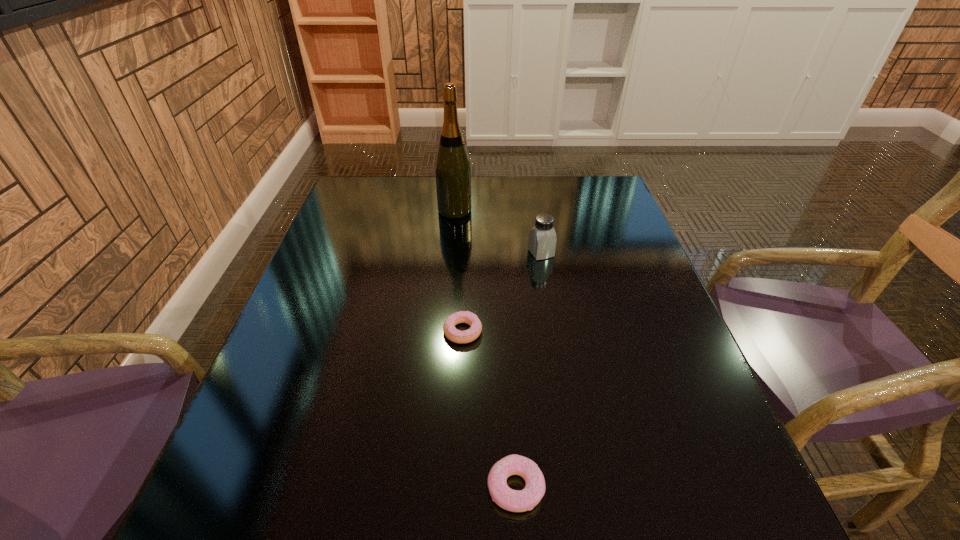
Locate an element on the screen. This screenshot has width=960, height=540. the farthest object is located at coordinates (452, 167).

Find the location of a particular element. the tallest object is located at coordinates (452, 167).

The height and width of the screenshot is (540, 960). I want to click on saltshaker, so click(x=542, y=237).

You are a GUI agent. You are given a task and a screenshot of the screen. Output one action in this format:
    pyautogui.click(x=<x>, y=<y>)
    Task: Click on the rightmost object
    
    Given the screenshot: What is the action you would take?
    pyautogui.click(x=542, y=237)

I want to click on the farther doughnut, so click(461, 337).

At what (x,y) coordinates should I click in order to perform the action: click on the left doughnut. Please return your answer as a coordinate pair (x, y). Looking at the image, I should click on (461, 337).

Locate an element on the screen. The height and width of the screenshot is (540, 960). the right doughnut is located at coordinates (511, 500).

The width and height of the screenshot is (960, 540). Identify the location of the nearest object. (511, 500).

What are the coordinates of `free location located on the front-facing side of the farthest object` in the screenshot? It's located at (516, 211).

At what (x,y) coordinates should I click in order to perform the action: click on vacant point located on the right of the third nearest object. Please return your answer as a coordinate pair (x, y). The width and height of the screenshot is (960, 540). Looking at the image, I should click on (585, 253).